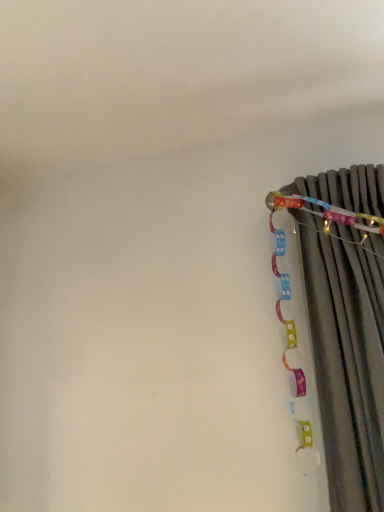
In order to face silky gray curtain at right, should I rotate leftwards or rightwards?

It's best to rotate right around 21.599 degrees.

At what (x,y) coordinates should I click in order to perform the action: click on silky gray curtain at right. Please return your answer as a coordinate pair (x, y). Image resolution: width=384 pixels, height=512 pixels. Looking at the image, I should click on (345, 327).

Describe the element at coordinates (345, 327) in the screenshot. The height and width of the screenshot is (512, 384). I see `silky gray curtain at right` at that location.

This screenshot has height=512, width=384. In order to click on silky gray curtain at right in this screenshot , I will do `click(345, 327)`.